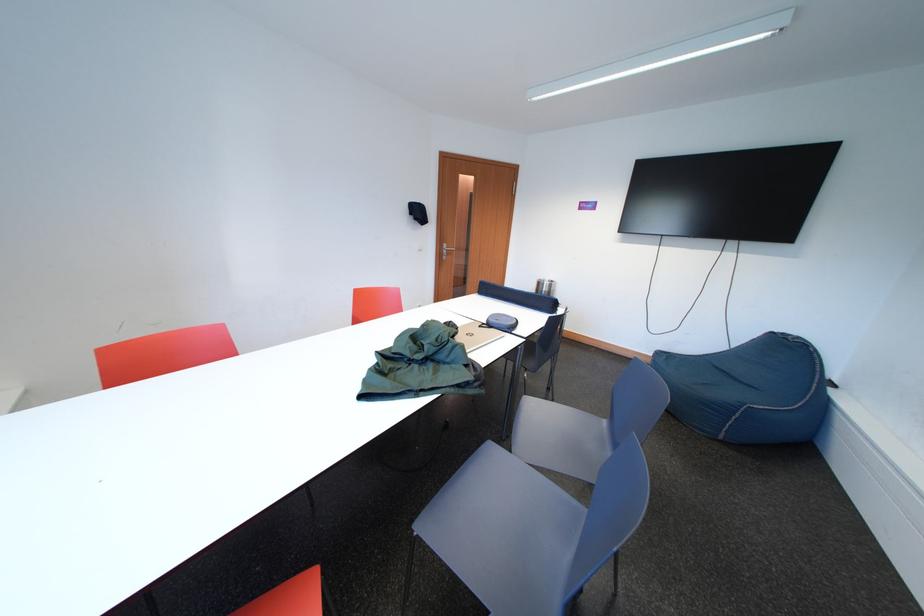
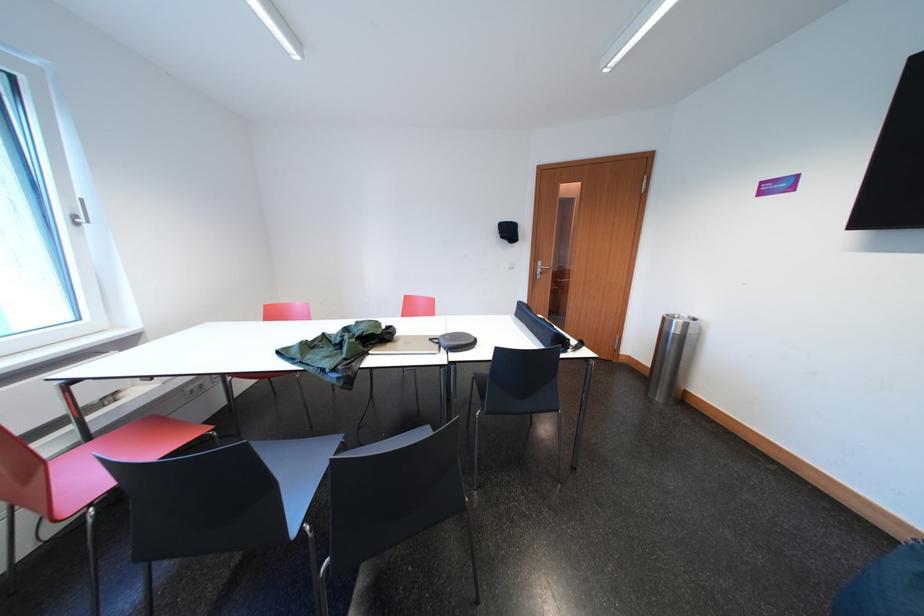
Where in the second image is the point corresponding to [455,249] from the first image?

(550, 268)